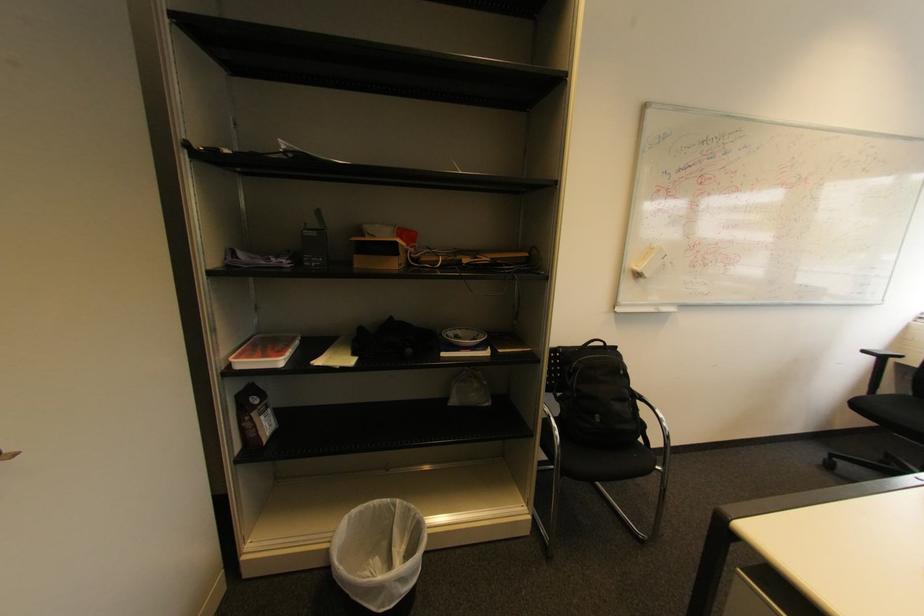
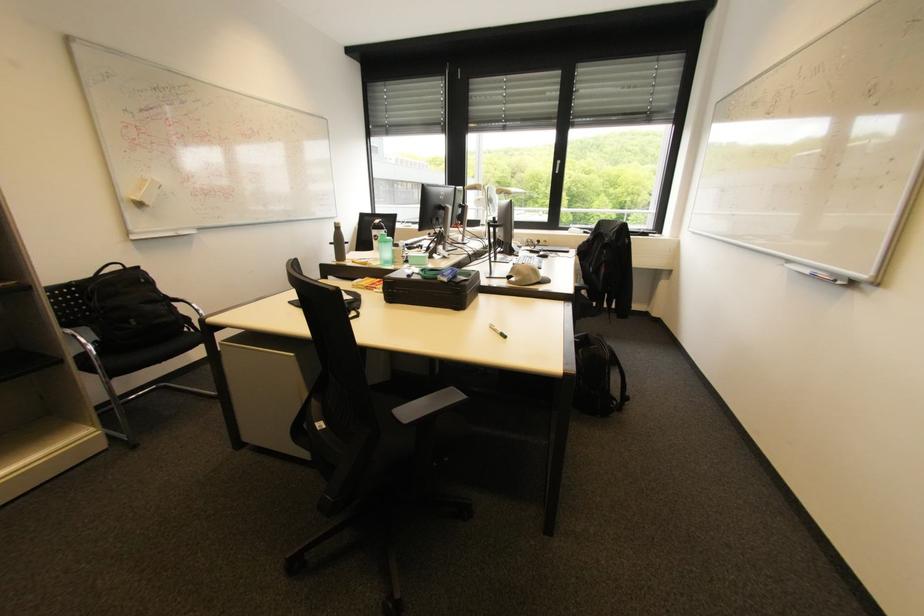
Find the pixel in the second image that matches [869,352] in the first image.

(335, 244)